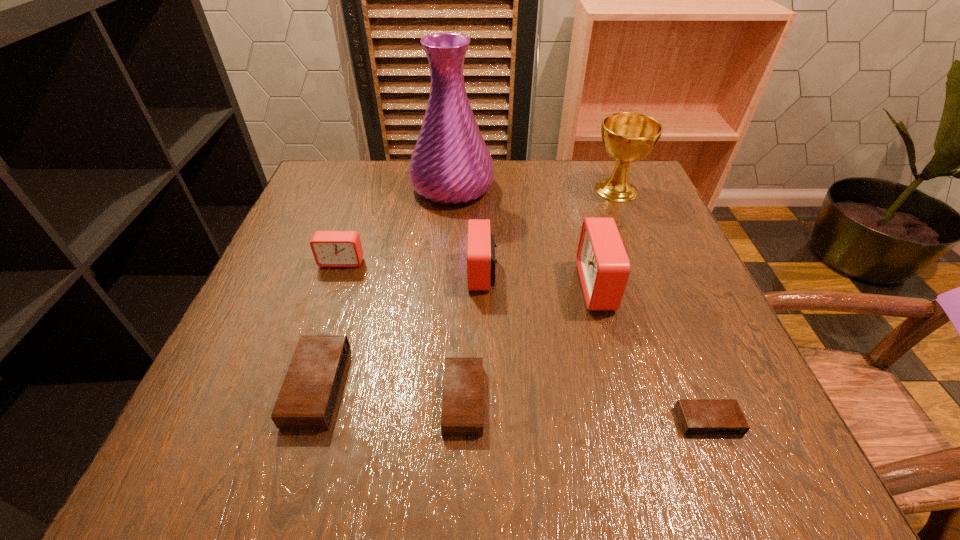
I want to click on the leftmost black alarm clock, so click(x=307, y=399).

Locate an element on the screen. Image resolution: width=960 pixels, height=540 pixels. the third shortest alarm clock is located at coordinates (307, 399).

The height and width of the screenshot is (540, 960). Identify the location of the second shortest object. (462, 406).

You are a GUI agent. You are given a task and a screenshot of the screen. Output one action in this format:
    pyautogui.click(x=<x>, y=<y>)
    Task: Click on the second shortest alarm clock
    The width and height of the screenshot is (960, 540).
    Given the screenshot: What is the action you would take?
    pyautogui.click(x=462, y=406)

Identify the location of the shortest alarm clock. The image size is (960, 540). (696, 416).

This screenshot has height=540, width=960. I want to click on the shortest object, so click(x=696, y=416).

The height and width of the screenshot is (540, 960). I want to click on vacant space located 0.150m on the left of the tallest object, so click(352, 187).

Find the location of `free location located on the left of the second tallest object`. free location located on the left of the second tallest object is located at coordinates (550, 190).

Where is `free space located on the front-facing side of the third tallest object`? The width and height of the screenshot is (960, 540). free space located on the front-facing side of the third tallest object is located at coordinates (483, 286).

Where is `free spot located 0.110m on the front-facing side of the third tallest object`? This screenshot has width=960, height=540. free spot located 0.110m on the front-facing side of the third tallest object is located at coordinates (524, 286).